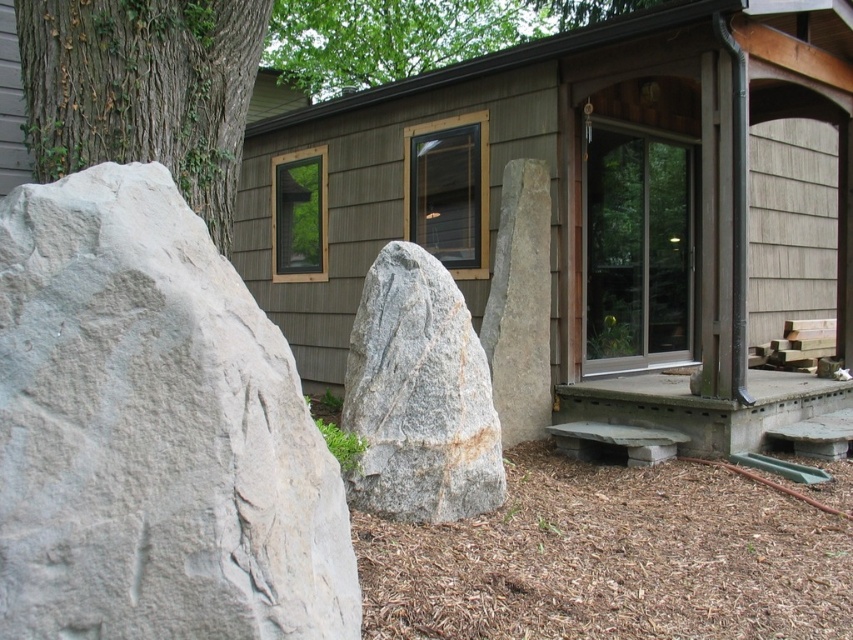
How distant is green rough bark tree at left from gray granite rock at center?

4.75 feet

Can you confirm if green rough bark tree at left is wider than gray granite rock at center?

Yes.

Is point (35, 144) behind point (466, 340)?

No.

You are a GUI agent. You are given a task and a screenshot of the screen. Output one action in this format:
    pyautogui.click(x=<x>, y=<y>)
    Task: Click on the green rough bark tree at left
    
    Given the screenshot: What is the action you would take?
    pyautogui.click(x=143, y=90)

Between point (123, 12) and point (715, 451), which one is positioned behind?

The point (715, 451) is behind.

Is the position of green rough bark tree at left more distant than that of concrete at lower right?

No, green rough bark tree at left is in front of concrete at lower right.

Which is in front, point (93, 36) or point (669, 392)?

Point (93, 36)

You are a GUI agent. You are given a task and a screenshot of the screen. Output one action in this format:
    pyautogui.click(x=<x>, y=<y>)
    Task: Click on the green rough bark tree at left
    This screenshot has width=853, height=640.
    Given the screenshot: What is the action you would take?
    pyautogui.click(x=143, y=90)

In order to click on wooden cabin at center in this screenshot , I will do `click(592, 204)`.

Is wooden cabin at center to the right of green rough bark tree at left from the viewer's perspective?

Yes, wooden cabin at center is to the right of green rough bark tree at left.

Describe the element at coordinates (592, 204) in the screenshot. I see `wooden cabin at center` at that location.

Where is `wooden cabin at center`? The image size is (853, 640). wooden cabin at center is located at coordinates (592, 204).